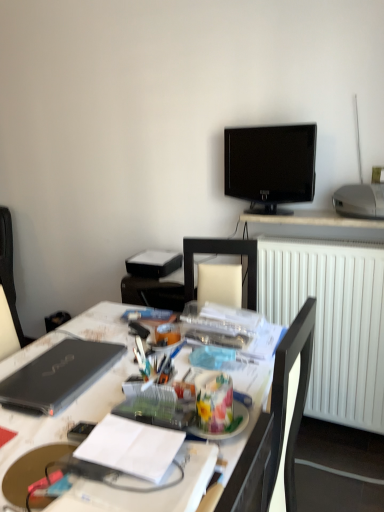
This screenshot has height=512, width=384. Describe the element at coordinates (9, 272) in the screenshot. I see `dark gray fabric computer chair at left` at that location.

What is the approximate width of dark gray fabric computer chair at left?

The width of dark gray fabric computer chair at left is 11.93 inches.

The width and height of the screenshot is (384, 512). In order to click on white glossy desk at center in this screenshot , I will do `click(76, 399)`.

Locate an element on the screen. The height and width of the screenshot is (512, 384). black matte laptop at left is located at coordinates (59, 375).

In order to face white matte radiator at right, should I rotate leftwards or rightwards?

It's best to rotate right around 16.512 degrees.

Describe the element at coordinates (332, 321) in the screenshot. I see `white matte radiator at right` at that location.

In order to face black glossy tv at upper center, should I rotate leftwards or rightwards?

It's best to rotate right around 9.479 degrees.

Where is `silver metallic projector at upper right`? silver metallic projector at upper right is located at coordinates (360, 201).

Which is in front, silver metallic projector at upper right or white matte radiator at right?

silver metallic projector at upper right.

In terms of height, does silver metallic projector at upper right look taller or shorter compared to white matte radiator at right?

In the image, silver metallic projector at upper right appears to be shorter than white matte radiator at right.

Considering the relative sizes of silver metallic projector at upper right and white matte radiator at right in the image provided, is silver metallic projector at upper right bigger than white matte radiator at right?

No.

Is silver metallic projector at upper right turned away from white matte radiator at right?

No, silver metallic projector at upper right is not facing the opposite direction of white matte radiator at right.

Between point (173, 432) and point (340, 205), which one is positioned behind?

Positioned behind is point (340, 205).

Is silver metallic projector at upper right at the back of white paper notebook at center?

No, white paper notebook at center's orientation is not away from silver metallic projector at upper right.

Considering the relative positions of white paper notebook at center and silver metallic projector at upper right in the image provided, is white paper notebook at center to the left of silver metallic projector at upper right from the viewer's perspective?

Yes.

Considering the sizes of white paper notebook at center and silver metallic projector at upper right in the image, is white paper notebook at center taller or shorter than silver metallic projector at upper right?

Considering their sizes, white paper notebook at center has less height than silver metallic projector at upper right.

Can you confirm if black matte laptop at left is positioned to the right of silver metallic projector at upper right?

Incorrect, black matte laptop at left is not on the right side of silver metallic projector at upper right.

Can you see black matte laptop at left touching silver metallic projector at upper right?

black matte laptop at left and silver metallic projector at upper right are clearly separated.

From a real-world perspective, is black matte laptop at left physically located above or below silver metallic projector at upper right?

From a real-world perspective, black matte laptop at left is physically below silver metallic projector at upper right.

Considering the positions of points (57, 350) and (347, 213), is point (57, 350) closer to camera compared to point (347, 213)?

Yes, point (57, 350) is closer to viewer.

Considering the positions of points (367, 206) and (41, 377), is point (367, 206) closer to camera compared to point (41, 377)?

No, (367, 206) is further to viewer.

Measure the distance from silver metallic projector at upper right to black matte laptop at left.

The distance of silver metallic projector at upper right from black matte laptop at left is 4.27 feet.

From a real-world perspective, which is physically below, silver metallic projector at upper right or black matte laptop at left?

black matte laptop at left.

From the image's perspective, is silver metallic projector at upper right below black matte laptop at left?

Actually, silver metallic projector at upper right appears above black matte laptop at left in the image.

Locate an element on the screen. The image size is (384, 512). computer chair that appears above the white glossy desk at center (from the image's perspective) is located at coordinates (9, 272).

Between dark gray fabric computer chair at left and white glossy desk at center, which one has more height?

With more height is dark gray fabric computer chair at left.

Between dark gray fabric computer chair at left and white glossy desk at center, which one appears on the left side from the viewer's perspective?

Positioned to the left is dark gray fabric computer chair at left.

From the image's perspective, which one is positioned lower, dark gray fabric computer chair at left or white glossy desk at center?

white glossy desk at center appears lower in the image.

Based on the photo, is white matte radiator at right not close to white paper notebook at center?

Yes, white matte radiator at right and white paper notebook at center are located far from each other.

In the scene shown: Considering the relative positions of white matte radiator at right and white paper notebook at center in the image provided, is white matte radiator at right to the right of white paper notebook at center from the viewer's perspective?

Indeed, white matte radiator at right is positioned on the right side of white paper notebook at center.

Is white matte radiator at right facing towards white paper notebook at center?

Yes, white matte radiator at right is oriented towards white paper notebook at center.

From the image's perspective, between white matte radiator at right and white paper notebook at center, which one is located above?

From the image's view, white matte radiator at right is above.

From the image's perspective, which is below, dark gray fabric computer chair at left or black glossy tv at upper center?

dark gray fabric computer chair at left appears lower in the image.

Can you confirm if dark gray fabric computer chair at left is bigger than black glossy tv at upper center?

Correct, dark gray fabric computer chair at left is larger in size than black glossy tv at upper center.

Does dark gray fabric computer chair at left have a lesser height compared to black glossy tv at upper center?

No.

Where is `radiator below the silver metallic projector at upper right (from the image's perspective)`? The width and height of the screenshot is (384, 512). radiator below the silver metallic projector at upper right (from the image's perspective) is located at coordinates point(332,321).

Find the location of a particular element. The height and width of the screenshot is (512, 384). printer positioned vertically above the white paper notebook at center (from a real-world perspective) is located at coordinates (360, 201).

Based on their spatial positions, is white paper notebook at center or dark gray fabric computer chair at left closer to white glossy desk at center?

white paper notebook at center.

Considering their positions, is white matte radiator at right positioned closer to silver metallic projector at upper right than white paper notebook at center?

white matte radiator at right lies closer to silver metallic projector at upper right than the other object.

Based on their spatial positions, is black glossy tv at upper center or silver metallic projector at upper right further from translucent plastic container at center?

The object further to translucent plastic container at center is black glossy tv at upper center.

When comparing their distances from black matte laptop at left, does white matte radiator at right or translucent plastic container at center seem further?

white matte radiator at right is positioned further to the anchor black matte laptop at left.

Looking at the image, which one is located closer to translucent plastic container at center, white glossy desk at center or dark gray fabric computer chair at left?

Based on the image, white glossy desk at center appears to be nearer to translucent plastic container at center.

Estimate the real-world distances between objects in this image. Which object is further from white matte radiator at right, dark gray fabric computer chair at left or white paper notebook at center?

The object further to white matte radiator at right is dark gray fabric computer chair at left.

Based on their spatial positions, is white matte radiator at right or black matte laptop at left further from white paper notebook at center?

The object further to white paper notebook at center is white matte radiator at right.

From the image, which object appears to be farther from silver metallic projector at upper right, dark gray fabric computer chair at left or black matte laptop at left?

dark gray fabric computer chair at left is further to silver metallic projector at upper right.

You are a GUI agent. You are given a task and a screenshot of the screen. Output one action in this format:
    pyautogui.click(x=<x>, y=<y>)
    Task: Click on the stationery positioned between white paper notebook at center and black glossy tv at upper center from near to far
    This screenshot has height=512, width=384.
    Given the screenshot: What is the action you would take?
    pyautogui.click(x=214, y=401)

Find the location of a particular element. The width and height of the screenshot is (384, 512). television between dark gray fabric computer chair at left and silver metallic projector at upper right from left to right is located at coordinates (271, 166).

Image resolution: width=384 pixels, height=512 pixels. I want to click on laptop between white glossy desk at center and black glossy tv at upper center along the z-axis, so click(x=59, y=375).

Locate an element on the screen. The width and height of the screenshot is (384, 512). radiator located between dark gray fabric computer chair at left and silver metallic projector at upper right in the left-right direction is located at coordinates (332, 321).